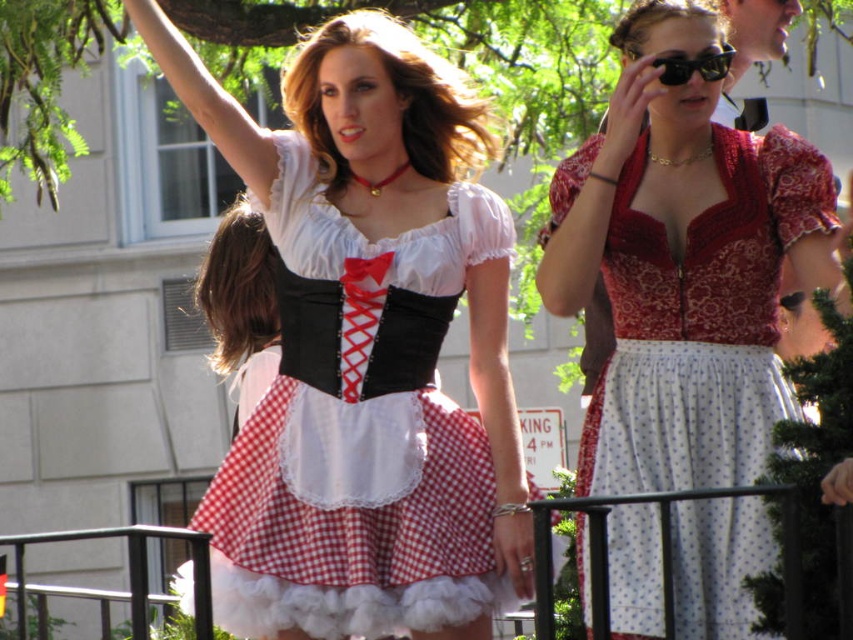
Does red checkered dress at center appear over red lace dress at center?

Actually, red checkered dress at center is below red lace dress at center.

Does red checkered dress at center have a lesser height compared to red lace dress at center?

Correct, red checkered dress at center is not as tall as red lace dress at center.

Find the location of a particular element. red checkered dress at center is located at coordinates (368, 352).

Identify the location of red checkered dress at center. pyautogui.click(x=368, y=352).

Which is in front, point (724, 401) or point (726, 44)?

Positioned in front is point (724, 401).

Image resolution: width=853 pixels, height=640 pixels. What are the coordinates of `red lace dress at center` in the screenshot? It's located at (685, 266).

Does black metal rail at lower center appear on the right side of black plastic goggles at upper center?

In fact, black metal rail at lower center is to the left of black plastic goggles at upper center.

In the scene shown: Is black metal rail at lower center bigger than black plastic goggles at upper center?

Indeed, black metal rail at lower center has a larger size compared to black plastic goggles at upper center.

Describe the element at coordinates (660, 552) in the screenshot. I see `black metal rail at lower center` at that location.

Find the location of a particular element. black metal rail at lower center is located at coordinates (660, 552).